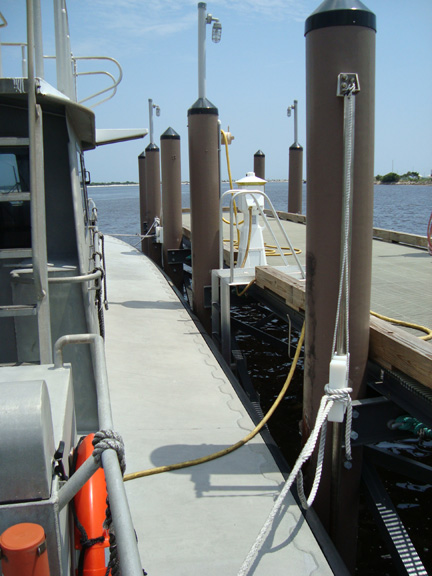
Where is `stairs`? This screenshot has width=432, height=576. stairs is located at coordinates 26,309.